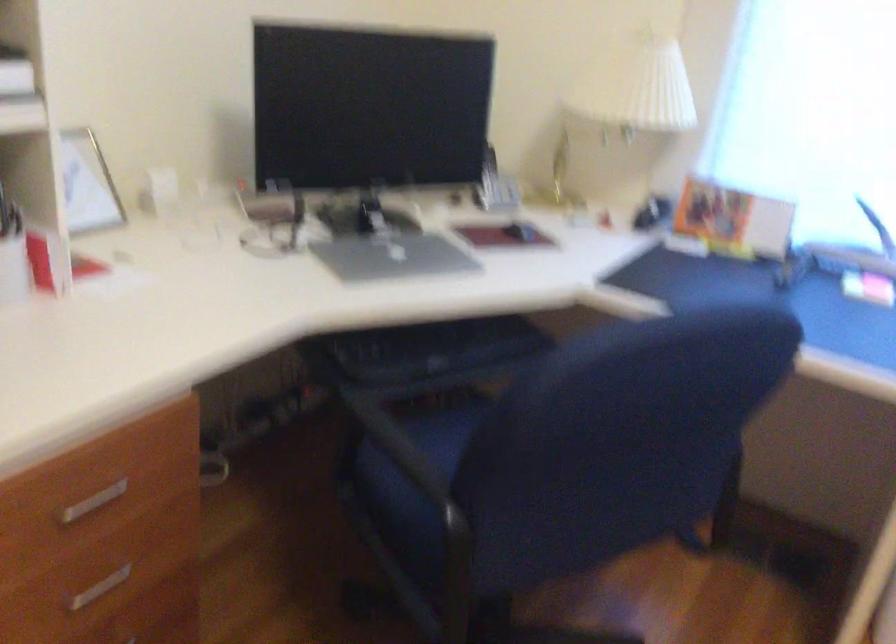
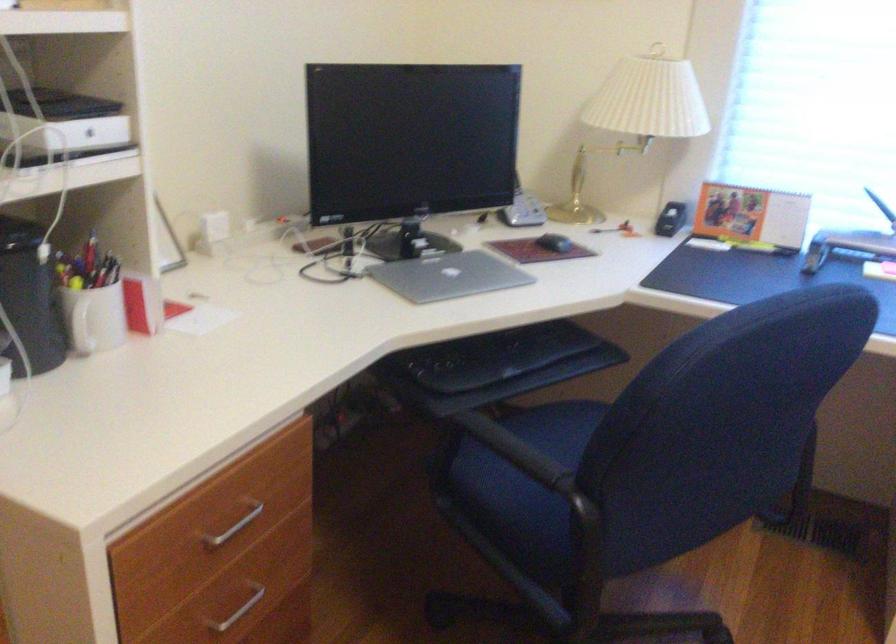
In the second image, find the point that corresponds to (518,229) in the first image.

(554, 243)